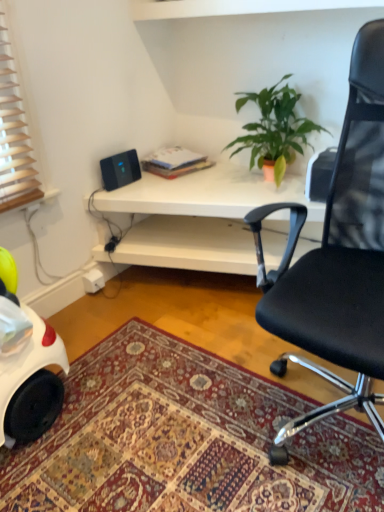
What is the approximate width of carpeted rug at lower center?

The width of carpeted rug at lower center is 1.19 meters.

I want to click on green matte plant at upper center, so click(274, 128).

Where is `carpeted rug at lower center`? This screenshot has width=384, height=512. carpeted rug at lower center is located at coordinates (186, 439).

Where is `chair located in front of the carpeted rug at lower center`? This screenshot has width=384, height=512. chair located in front of the carpeted rug at lower center is located at coordinates (342, 258).

Is point (355, 268) positioned behind point (143, 333)?

No, (355, 268) is closer to viewer.

Is black mesh office chair at upper right situated inside carpeted rug at lower center or outside?

black mesh office chair at upper right lies outside carpeted rug at lower center.

Is green matte plant at upper center facing towards black mesh office chair at upper right?

No, green matte plant at upper center is not turned towards black mesh office chair at upper right.

What are the coordinates of `chair below the green matte plant at upper center (from the image's perspective)` in the screenshot? It's located at [342, 258].

How much distance is there between green matte plant at upper center and black mesh office chair at upper right?

green matte plant at upper center and black mesh office chair at upper right are 30.18 inches apart.

From a real-world perspective, who is located lower, green matte plant at upper center or black mesh office chair at upper right?

black mesh office chair at upper right, from a real-world perspective.

How many degrees apart are the facing directions of carpeted rug at lower center and green matte plant at upper center?

88.3 degrees separate the facing orientations of carpeted rug at lower center and green matte plant at upper center.

Does carpeted rug at lower center turn towards green matte plant at upper center?

No.

From the image's perspective, between carpeted rug at lower center and green matte plant at upper center, who is located below?

carpeted rug at lower center, from the image's perspective.

Does carpeted rug at lower center appear on the left side of green matte plant at upper center?

Correct, you'll find carpeted rug at lower center to the left of green matte plant at upper center.

From the image's perspective, is white matte desk at center on black plastic speaker at upper left?

No, from the image's perspective, white matte desk at center is not over black plastic speaker at upper left.

Is white matte desk at center located outside black plastic speaker at upper left?

Yes, white matte desk at center is not within black plastic speaker at upper left.

Considering the sizes of white matte desk at center and black plastic speaker at upper left in the image, is white matte desk at center bigger or smaller than black plastic speaker at upper left?

Considering their sizes, white matte desk at center takes up more space than black plastic speaker at upper left.

Is white matte desk at center turned away from black plastic speaker at upper left?

No.

Can you tell me how much black plastic speaker at upper left and white matte desk at center differ in facing direction?

The angular difference between black plastic speaker at upper left and white matte desk at center is 89.1 degrees.

Is black plastic speaker at upper left situated inside white matte desk at center or outside?

black plastic speaker at upper left is not inside white matte desk at center, it's outside.

This screenshot has width=384, height=512. I want to click on desk below the black plastic speaker at upper left (from a real-world perspective), so click(200, 218).

How distant is black plastic speaker at upper left from white matte desk at center?

black plastic speaker at upper left is 15.47 inches from white matte desk at center.

Is black plastic speaker at upper left bigger than black mesh office chair at upper right?

Actually, black plastic speaker at upper left might be smaller than black mesh office chair at upper right.

From a real-world perspective, is black plastic speaker at upper left positioned over black mesh office chair at upper right based on gravity?

No, from a real-world perspective, black plastic speaker at upper left is not above black mesh office chair at upper right.

Is black plastic speaker at upper left in contact with black mesh office chair at upper right?

No, black plastic speaker at upper left is not in contact with black mesh office chair at upper right.

Is black plastic speaker at upper left facing away from black mesh office chair at upper right?

No, black mesh office chair at upper right is not at the back of black plastic speaker at upper left.

Is carpeted rug at lower center facing towards white matte desk at center?

No.

From a real-world perspective, who is located higher, carpeted rug at lower center or white matte desk at center?

white matte desk at center, from a real-world perspective.

Is the surface of carpeted rug at lower center in direct contact with white matte desk at center?

carpeted rug at lower center is not next to white matte desk at center, and they're not touching.

The height and width of the screenshot is (512, 384). Find the location of `mat below the white matte desk at center (from the image's perspective)`. mat below the white matte desk at center (from the image's perspective) is located at coordinates (186, 439).

The image size is (384, 512). I want to click on chair on the right of the carpeted rug at lower center, so click(x=342, y=258).

What are the coordinates of `chair in front of the green matte plant at upper center` in the screenshot? It's located at (342, 258).

Considering their positions, is black mesh office chair at upper right positioned closer to white matte desk at center than black plastic speaker at upper left?

black plastic speaker at upper left.

Estimate the real-world distances between objects in this image. Which object is closer to black plastic speaker at upper left, black mesh office chair at upper right or green matte plant at upper center?

green matte plant at upper center lies closer to black plastic speaker at upper left than the other object.

Based on their spatial positions, is black mesh office chair at upper right or black plastic speaker at upper left further from carpeted rug at lower center?

black plastic speaker at upper left.

Looking at the image, which one is located closer to black plastic speaker at upper left, black mesh office chair at upper right or white matte desk at center?

Based on the image, white matte desk at center appears to be nearer to black plastic speaker at upper left.

When comparing their distances from black plastic speaker at upper left, does white matte desk at center or black mesh office chair at upper right seem further?

black mesh office chair at upper right is positioned further to the anchor black plastic speaker at upper left.

From the image, which object appears to be farther from black mesh office chair at upper right, carpeted rug at lower center or green matte plant at upper center?

green matte plant at upper center lies further to black mesh office chair at upper right than the other object.

Based on their spatial positions, is black plastic speaker at upper left or green matte plant at upper center further from carpeted rug at lower center?

The object further to carpeted rug at lower center is green matte plant at upper center.

From the picture: When comparing their distances from carpeted rug at lower center, does black mesh office chair at upper right or white matte desk at center seem further?

Among the two, white matte desk at center is located further to carpeted rug at lower center.

Locate an element on the screen. Image resolution: width=384 pixels, height=512 pixels. desk between carpeted rug at lower center and black plastic speaker at upper left along the z-axis is located at coordinates (200, 218).

Identify the location of chair between green matte plant at upper center and carpeted rug at lower center in the up-down direction. (342, 258).

Where is `houseplant located between black mesh office chair at upper right and black plastic speaker at upper left in the depth direction`? The image size is (384, 512). houseplant located between black mesh office chair at upper right and black plastic speaker at upper left in the depth direction is located at coordinates (x=274, y=128).

Find the location of `desk between black mesh office chair at upper right and black plastic speaker at upper left along the z-axis`. desk between black mesh office chair at upper right and black plastic speaker at upper left along the z-axis is located at coordinates (200, 218).